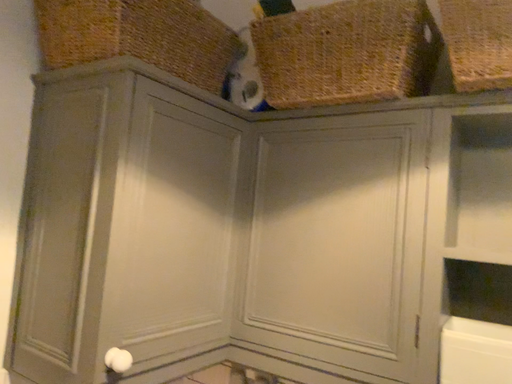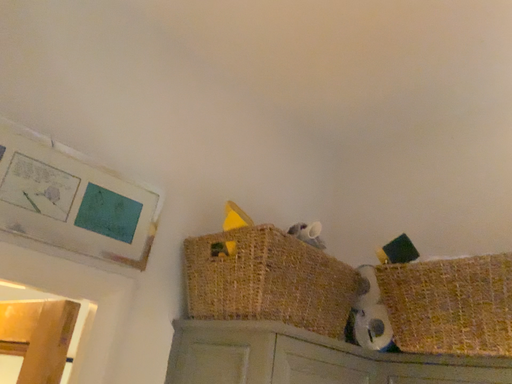
Question: How did the camera likely rotate when shooting the video?

Choices:
 (A) rotated upward
 (B) rotated downward

Answer: (A)